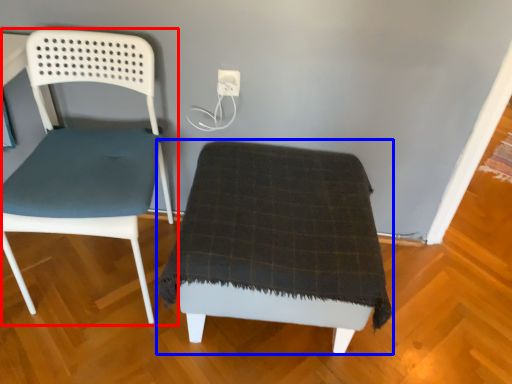
Question: Which point is closer to the camera, chair (highlighted by a red box) or furniture (highlighted by a blue box)?

Choices:
 (A) chair
 (B) furniture

Answer: (A)